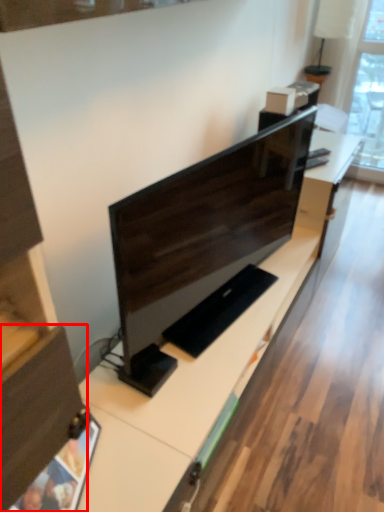
Question: From the image's perspective, where is drawer (annotated by the red box) located relative to computer monitor?

Choices:
 (A) below
 (B) above

Answer: (A)